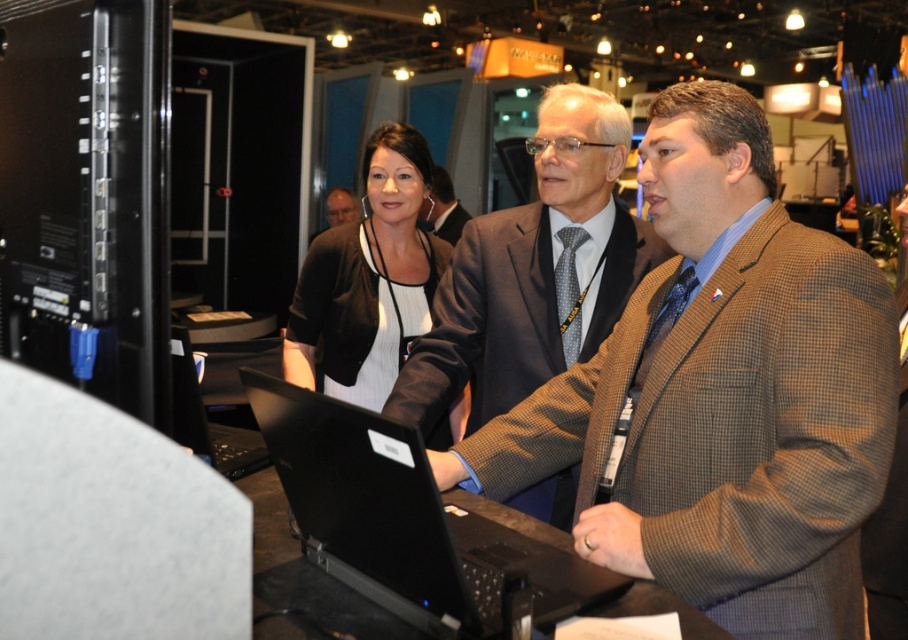
You are attending a trade show and need to approach the speaker who is wearing a brown checkered blazer at center. There is also a person in a dark gray wool suit at center nearby. Which clothing item should you walk towards first to reach the speaker?

The brown checkered blazer at center is closer to the viewer than the dark gray wool suit at center, so you should walk towards the brown checkered blazer at center first to reach the speaker.

Looking at this image, you are at a trade show and need to determine which clothing item is taller between the brown checkered blazer at center and the green textured sweater at center. Based on the scene description, which one is taller?

The brown checkered blazer at center is taller than the green textured sweater at center according to the description.